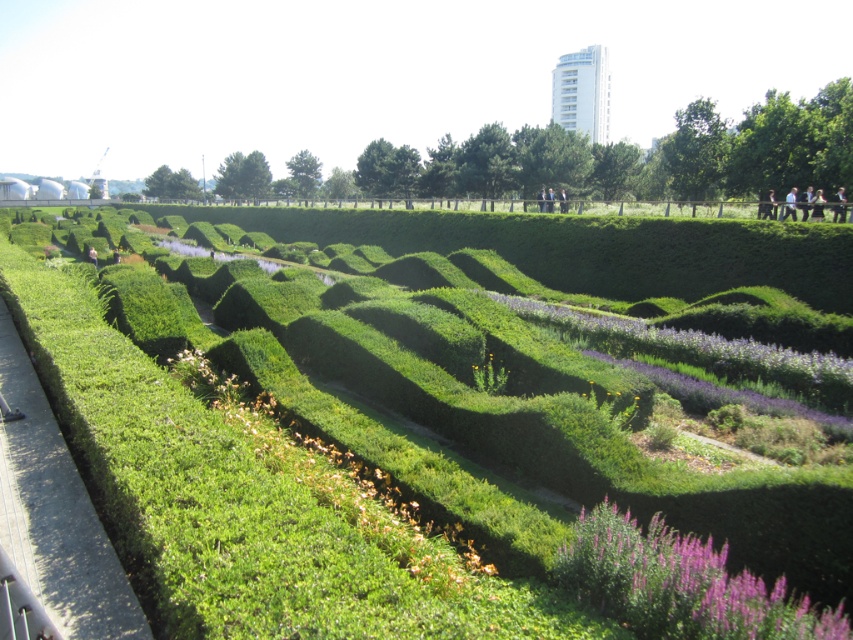
Is green hedge maze at center positioned behind light blue shirt at upper right?

No, green hedge maze at center is closer to the viewer.

Between green hedge maze at center and light blue shirt at upper right, which one is positioned lower?

green hedge maze at center is below.

Does point (190, 486) come farther from viewer compared to point (786, 204)?

No, it is in front of (786, 204).

Image resolution: width=853 pixels, height=640 pixels. I want to click on green hedge maze at center, so click(x=537, y=454).

Who is more forward, (90, 400) or (688, 355)?

Positioned in front is point (90, 400).

This screenshot has height=640, width=853. In order to click on green hedge maze at center in this screenshot , I will do `click(537, 454)`.

Can you confirm if purple fuzzy flower at lower right is smaller than purple soft-textured flowers at center?

Indeed, purple fuzzy flower at lower right has a smaller size compared to purple soft-textured flowers at center.

Is purple fuzzy flower at lower right wider than purple soft-textured flowers at center?

No, purple fuzzy flower at lower right is not wider than purple soft-textured flowers at center.

Image resolution: width=853 pixels, height=640 pixels. Describe the element at coordinates (680, 584) in the screenshot. I see `purple fuzzy flower at lower right` at that location.

At what (x,y) coordinates should I click in order to perform the action: click on purple fuzzy flower at lower right. Please return your answer as a coordinate pair (x, y). This screenshot has width=853, height=640. Looking at the image, I should click on (680, 584).